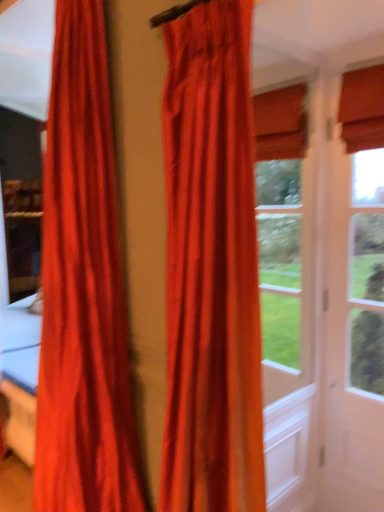
Question: Does satin-like red curtain at center, which appears as the 2th curtain when viewed from the left, have a smaller size compared to satin orange curtain at left, marked as the first curtain in a left-to-right arrangement?

Choices:
 (A) no
 (B) yes

Answer: (B)

Question: From the image's perspective, is satin-like red curtain at center, the first curtain positioned from the right, above satin orange curtain at left, which is the 2th curtain in right-to-left order?

Choices:
 (A) no
 (B) yes

Answer: (A)

Question: Could you tell me if satin-like red curtain at center, which appears as the 2th curtain when viewed from the left, is turned towards satin orange curtain at left, marked as the first curtain in a left-to-right arrangement?

Choices:
 (A) no
 (B) yes

Answer: (A)

Question: Does satin-like red curtain at center, which appears as the 2th curtain when viewed from the left, have a greater height compared to satin orange curtain at left, which is the 2th curtain in right-to-left order?

Choices:
 (A) yes
 (B) no

Answer: (B)

Question: Is satin orange curtain at left, marked as the first curtain in a left-to-right arrangement, a part of satin-like red curtain at center, which appears as the 2th curtain when viewed from the left?

Choices:
 (A) no
 (B) yes

Answer: (A)

Question: Relative to satin orange curtain at left, which is the 2th curtain in right-to-left order, is matte white screen door at right in front or behind?

Choices:
 (A) behind
 (B) front

Answer: (A)

Question: From a real-world perspective, is matte white screen door at right above or below satin orange curtain at left, marked as the first curtain in a left-to-right arrangement?

Choices:
 (A) above
 (B) below

Answer: (B)

Question: Is matte white screen door at right wider or thinner than satin orange curtain at left, which is the 2th curtain in right-to-left order?

Choices:
 (A) wide
 (B) thin

Answer: (B)

Question: From the image's perspective, is matte white screen door at right located above or below satin orange curtain at left, marked as the first curtain in a left-to-right arrangement?

Choices:
 (A) below
 (B) above

Answer: (A)

Question: Considering the relative positions of satin-like red curtain at center, which appears as the 2th curtain when viewed from the left, and satin orange curtain at left, which is the 2th curtain in right-to-left order, in the image provided, is satin-like red curtain at center, which appears as the 2th curtain when viewed from the left, to the left or to the right of satin orange curtain at left, which is the 2th curtain in right-to-left order,?

Choices:
 (A) right
 (B) left

Answer: (A)

Question: Considering the positions of satin-like red curtain at center, the first curtain positioned from the right, and satin orange curtain at left, marked as the first curtain in a left-to-right arrangement, in the image, is satin-like red curtain at center, the first curtain positioned from the right, bigger or smaller than satin orange curtain at left, marked as the first curtain in a left-to-right arrangement,?

Choices:
 (A) big
 (B) small

Answer: (B)

Question: From the image's perspective, is satin-like red curtain at center, which appears as the 2th curtain when viewed from the left, above or below satin orange curtain at left, marked as the first curtain in a left-to-right arrangement?

Choices:
 (A) below
 (B) above

Answer: (A)

Question: From their relative heights in the image, would you say satin-like red curtain at center, the first curtain positioned from the right, is taller or shorter than satin orange curtain at left, which is the 2th curtain in right-to-left order?

Choices:
 (A) tall
 (B) short

Answer: (B)

Question: Is satin orange curtain at left, marked as the first curtain in a left-to-right arrangement, taller or shorter than satin-like red curtain at center, the first curtain positioned from the right?

Choices:
 (A) short
 (B) tall

Answer: (B)

Question: Relative to satin-like red curtain at center, which appears as the 2th curtain when viewed from the left, is satin orange curtain at left, marked as the first curtain in a left-to-right arrangement, in front or behind?

Choices:
 (A) front
 (B) behind

Answer: (B)